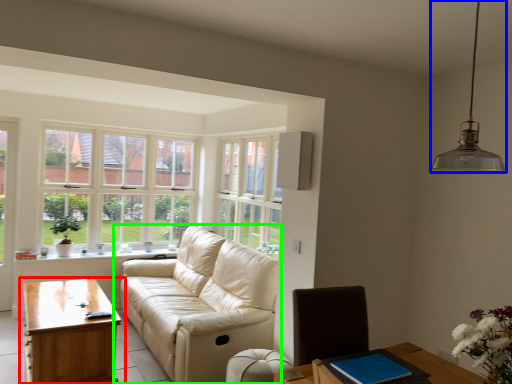
Question: Which object is positioned closest to table (highlighted by a red box)? Select from light fixture (highlighted by a blue box) and studio couch (highlighted by a green box).

Choices:
 (A) light fixture
 (B) studio couch

Answer: (B)